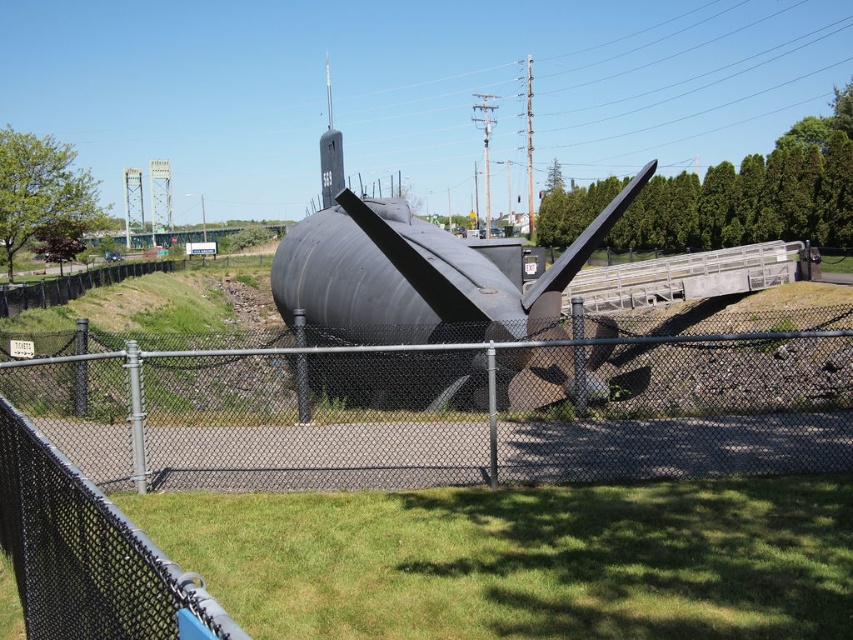
Question: Among these objects, which one is farthest from the camera?

Choices:
 (A) matte black submarine at center
 (B) green grass at lower center
 (C) gray chain-link fence at center

Answer: (A)

Question: Is gray chain-link fence at center behind green grass at lower center?

Choices:
 (A) no
 (B) yes

Answer: (B)

Question: Which point is closer to the camera?

Choices:
 (A) matte black submarine at center
 (B) gray chain-link fence at center

Answer: (B)

Question: Where is gray chain-link fence at center located in relation to green grass at lower center in the image?

Choices:
 (A) right
 (B) left

Answer: (A)

Question: Which point is closer to the camera taking this photo?

Choices:
 (A) (842, 316)
 (B) (370, 257)
 (C) (500, 532)

Answer: (C)

Question: Does green grass at lower center appear over matte black submarine at center?

Choices:
 (A) no
 (B) yes

Answer: (A)